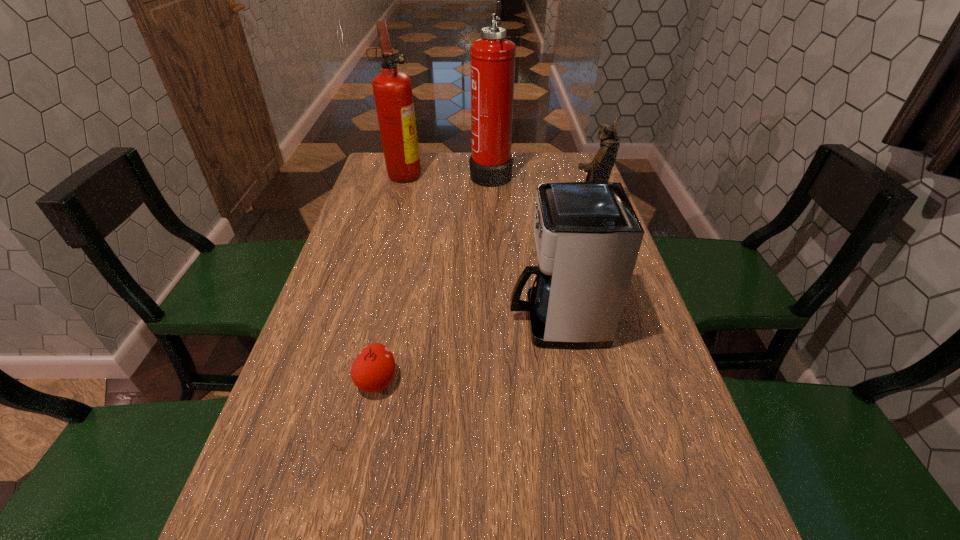
Find the location of `vacant region located on the front-facing side of the shorter fire extinguisher`. vacant region located on the front-facing side of the shorter fire extinguisher is located at coordinates (501, 173).

This screenshot has height=540, width=960. Identify the location of free spot located on the front panel of the coffee maker. (349, 320).

The height and width of the screenshot is (540, 960). What are the coordinates of `vacant space located on the front panel of the coffee maker` in the screenshot? It's located at (430, 320).

Where is `free spot located on the front panel of the coffee maker`? This screenshot has width=960, height=540. free spot located on the front panel of the coffee maker is located at coordinates (349, 320).

The height and width of the screenshot is (540, 960). I want to click on free space located on the front-facing side of the figurine, so click(472, 208).

Where is `blank space located on the front-facing side of the figurine`? The height and width of the screenshot is (540, 960). blank space located on the front-facing side of the figurine is located at coordinates (528, 208).

In order to click on free space located 0.200m on the front-facing side of the figurine in this screenshot , I will do `click(505, 208)`.

Image resolution: width=960 pixels, height=540 pixels. Find the location of `blank space located on the front of the apple`. blank space located on the front of the apple is located at coordinates (361, 458).

This screenshot has height=540, width=960. I want to click on fire extinguisher that is at the left edge, so click(x=392, y=89).

This screenshot has height=540, width=960. Find the location of `apple that is at the left edge`. apple that is at the left edge is located at coordinates (373, 369).